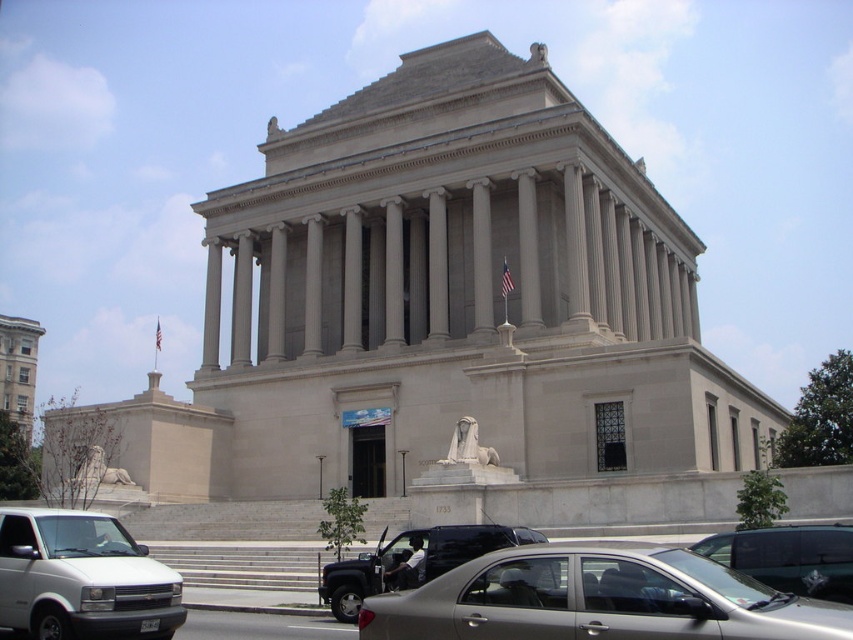
Question: Among these points, which one is farthest from the camera?

Choices:
 (A) (152, 602)
 (B) (695, 612)
 (C) (94, 470)

Answer: (C)

Question: Considering the real-world distances, which object is farthest from the white marble sphinx at center?

Choices:
 (A) gray stone lion at center
 (B) metallic black truck at center

Answer: (A)

Question: Does white matte van at lower left have a greater width compared to white marble sphinx at center?

Choices:
 (A) yes
 (B) no

Answer: (A)

Question: Can you confirm if metallic black truck at center is thinner than white marble sphinx at center?

Choices:
 (A) yes
 (B) no

Answer: (B)

Question: Can you confirm if silver metallic sedan at center is bigger than gray stone lion at center?

Choices:
 (A) no
 (B) yes

Answer: (B)

Question: Estimate the real-world distances between objects in this image. Which object is farther from the silver metallic sedan at center?

Choices:
 (A) metallic black truck at center
 (B) metallic silver van at center
 (C) gray stone lion at center
 (D) white marble sphinx at center

Answer: (C)